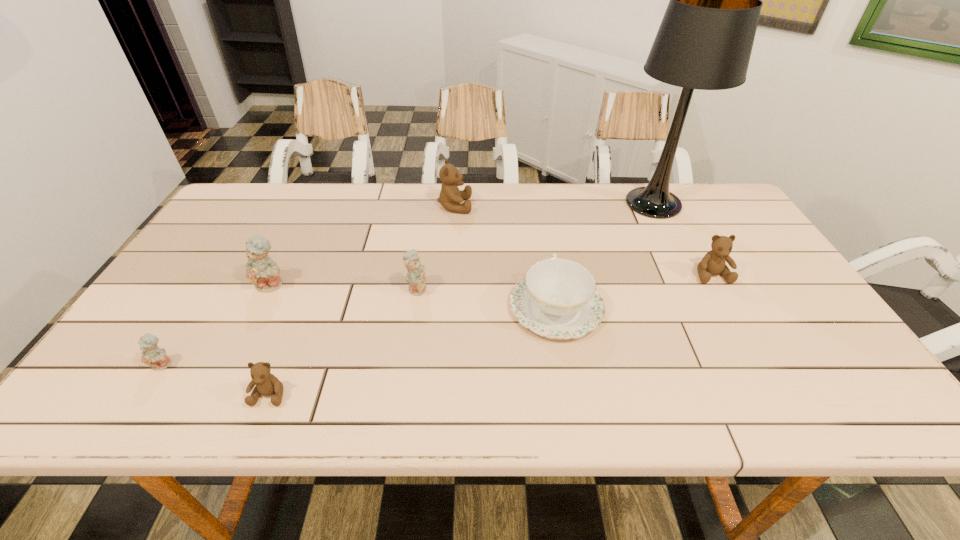
Find the location of `black table lamp`. black table lamp is located at coordinates (705, 39).

The height and width of the screenshot is (540, 960). In order to click on table lamp in this screenshot , I will do `click(705, 39)`.

In order to click on the second brown teddy bear from left to right in this screenshot , I will do `click(450, 197)`.

This screenshot has height=540, width=960. Find the location of `the farthest teddy bear`. the farthest teddy bear is located at coordinates (450, 197).

Where is `the fifth teddy bear from right to left`? This screenshot has height=540, width=960. the fifth teddy bear from right to left is located at coordinates [262, 271].

Where is `the second blue teddy bear from right to left`? The height and width of the screenshot is (540, 960). the second blue teddy bear from right to left is located at coordinates (262, 271).

Locate an element on the screen. the second biggest blue teddy bear is located at coordinates (416, 276).

Find the location of a particular element. The height and width of the screenshot is (540, 960). the second farthest brown teddy bear is located at coordinates (713, 263).

You are a GUI agent. You are given a task and a screenshot of the screen. Output one action in this format:
    pyautogui.click(x=<x>, y=<y>)
    Task: Click on the second biggest brown teddy bear
    
    Given the screenshot: What is the action you would take?
    pyautogui.click(x=713, y=263)

What are the coordinates of `the third object from right to left` in the screenshot? It's located at (557, 299).